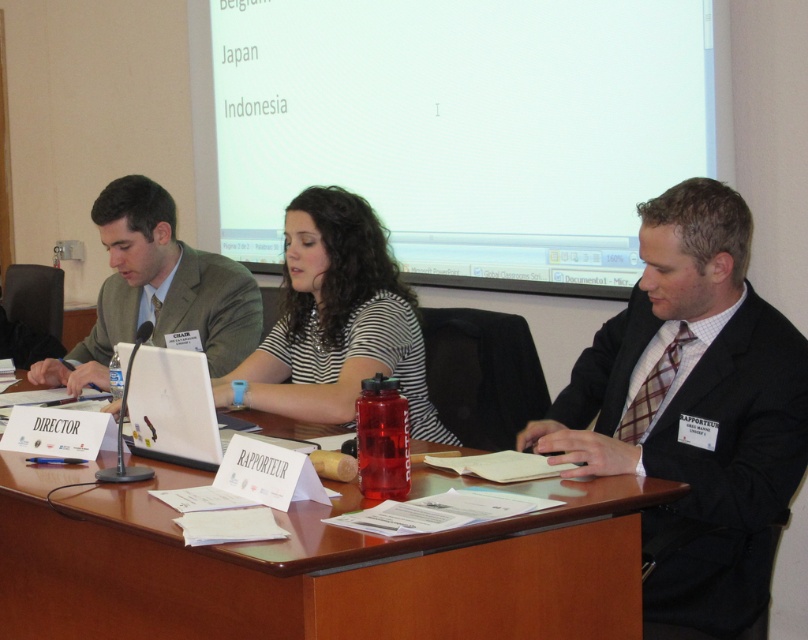
Question: Which point is closer to the camera?

Choices:
 (A) green fabric suit at left
 (B) wooden table at center

Answer: (B)

Question: Considering the real-world distances, which object is closest to the green fabric suit at left?

Choices:
 (A) wooden table at center
 (B) black suit at right

Answer: (A)

Question: Is wooden table at center above black suit at right?

Choices:
 (A) yes
 (B) no

Answer: (B)

Question: Which object appears farthest from the camera in this image?

Choices:
 (A) white matte projector screen at upper center
 (B) green fabric suit at left
 (C) striped fabric shirt at center

Answer: (A)

Question: Can you confirm if wooden table at center is positioned below white plastic laptop at center?

Choices:
 (A) yes
 (B) no

Answer: (A)

Question: Is black suit at right smaller than white plastic laptop at center?

Choices:
 (A) no
 (B) yes

Answer: (A)